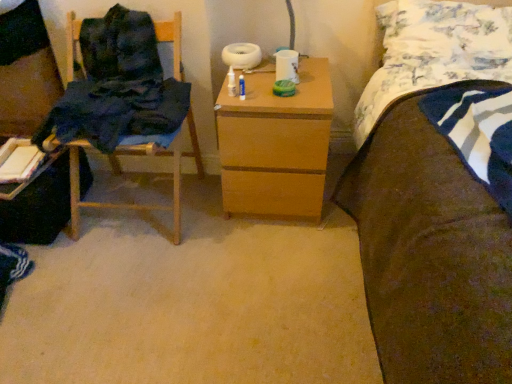
Where is `free area in between wooden nightstand at center and wooden chair at left`? The height and width of the screenshot is (384, 512). free area in between wooden nightstand at center and wooden chair at left is located at coordinates (214, 214).